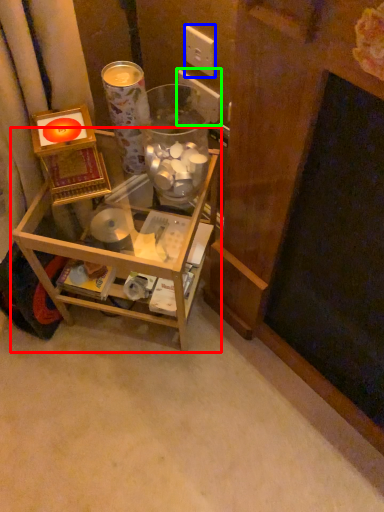
Question: Based on their relative distances, which object is farther from furniture (highlighted by a red box)? Choose from electric outlet (highlighted by a blue box) and electric outlet (highlighted by a green box).

Choices:
 (A) electric outlet
 (B) electric outlet

Answer: (A)